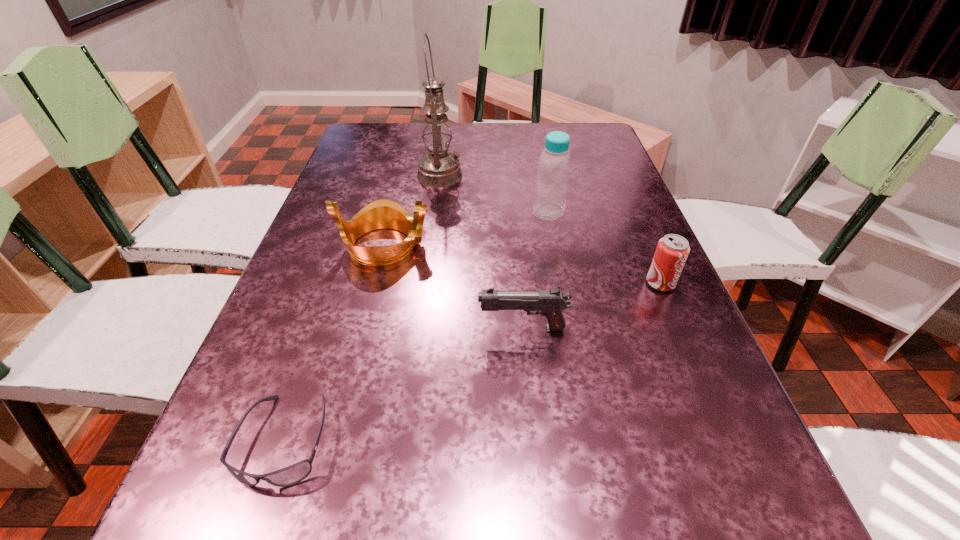
Image resolution: width=960 pixels, height=540 pixels. In order to click on unoccupied area between the shortest object and the second tallest object in this screenshot , I will do `click(417, 326)`.

Identify the location of free space between the farthest object and the sunglasses. (362, 307).

The width and height of the screenshot is (960, 540). What are the coordinates of `vacant space that is in between the oil lamp and the tiara` in the screenshot? It's located at (412, 210).

Where is `free space between the oil lamp and the second nearest object`? This screenshot has width=960, height=540. free space between the oil lamp and the second nearest object is located at coordinates (481, 252).

Where is `object that can be found as the fifth closest to the tiara`? The height and width of the screenshot is (540, 960). object that can be found as the fifth closest to the tiara is located at coordinates (672, 250).

Select which object is the third closest to the tiara. Please provide its 2D coordinates. Your answer should be formatted as a tuple, i.e. [(x, y)], where the tuple contains the x and y coordinates of a point satisfying the conditions above.

[(554, 165)]

Where is `blank space that satisfies the following two spatial constraints: 1. in the direction the gun is aimed; 2. on the lenses of the sunglasses`? The height and width of the screenshot is (540, 960). blank space that satisfies the following two spatial constraints: 1. in the direction the gun is aimed; 2. on the lenses of the sunglasses is located at coordinates (533, 440).

You are a GUI agent. You are given a task and a screenshot of the screen. Output one action in this format:
    pyautogui.click(x=<x>, y=<y>)
    Task: Click on the blank space that satisfies the following two spatial constraints: 1. at the front emblem of the rightmost object; 2. on the left side of the tiara
    Image resolution: width=960 pixels, height=540 pixels.
    Given the screenshot: What is the action you would take?
    pyautogui.click(x=374, y=284)

Locate an element on the screen. The width and height of the screenshot is (960, 540). free space that satisfies the following two spatial constraints: 1. at the front emblem of the tiara; 2. on the lenses of the sunglasses is located at coordinates (335, 440).